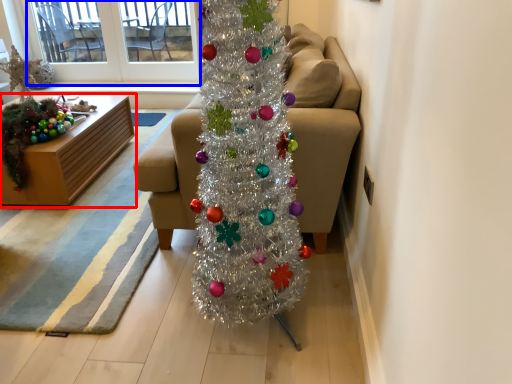
Question: Among these objects, which one is nearest to the camera, furniture (highlighted by a red box) or window screen (highlighted by a blue box)?

Choices:
 (A) furniture
 (B) window screen

Answer: (A)